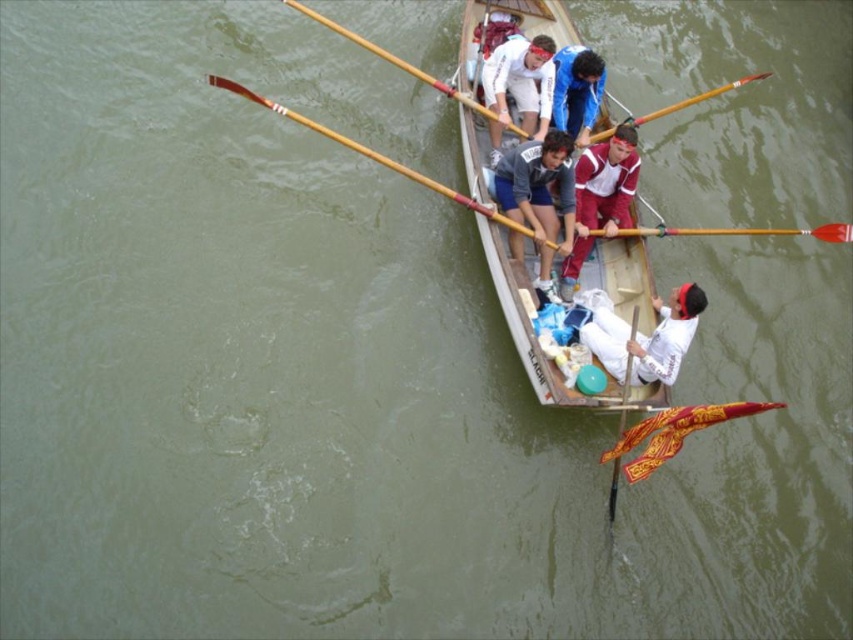
You are a photographer taking a picture of the rowing team from above. You notice the white cotton shirt at center and the wooden polished oar at center. Which object is located to the right of the other?

The white cotton shirt at center is positioned on the right side of wooden polished oar at center, so the white cotton shirt at center is to the right of the wooden polished oar at center.

You are a photographer taking a picture of the rowers from above. You notice the white cotton shirt at center and the wooden polished oar at center. Which object is closer to the camera?

The white cotton shirt at center is located above the wooden polished oar at center, so it is closer to the camera.

You are a photographer taking a picture of the rowing team from above. The white matte shirt at center and the wooden polished paddle at center are both in the frame. Which object appears taller in the photo?

The white matte shirt at center appears taller than the wooden polished paddle at center in the photo.